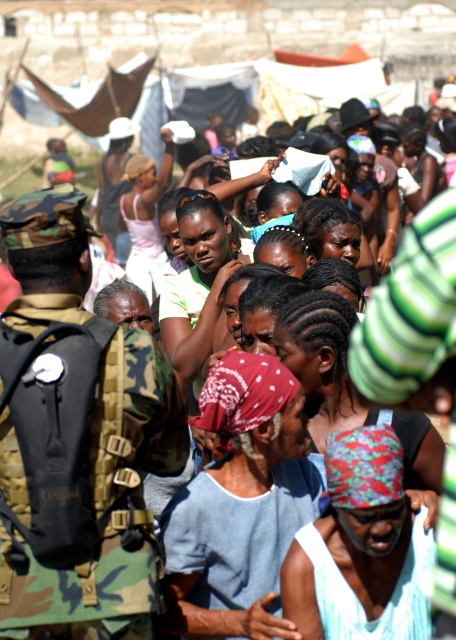
You are a photographer trying to capture a candid shot of the scene. You notice the camo uniform at left and the matte black sunglasses at center. Which object should you focus on first if you want to capture both in a single frame without moving the camera?

The camo uniform at left is below matte black sunglasses at center, so focusing on the matte black sunglasses at center first would allow you to include both in the frame as the uniform is positioned lower.

You are a humanitarian aid worker in the camp and need to distribute supplies. You see a light blue fabric at center and a multicolored fabric headscarf at center. Which object is closer to you?

The light blue fabric at center is closer to you because the multicolored fabric headscarf at center is behind it.

You are a humanitarian aid worker trying to reach the multicolored fabric headscarf at center to distribute supplies. You are currently standing near the camo uniform at left. Which object is closer to you, and why?

The camo uniform at left is closer to you because it is positioned further to the viewer than the multicolored fabric headscarf at center, meaning you are already near it and the headscarf is further away.